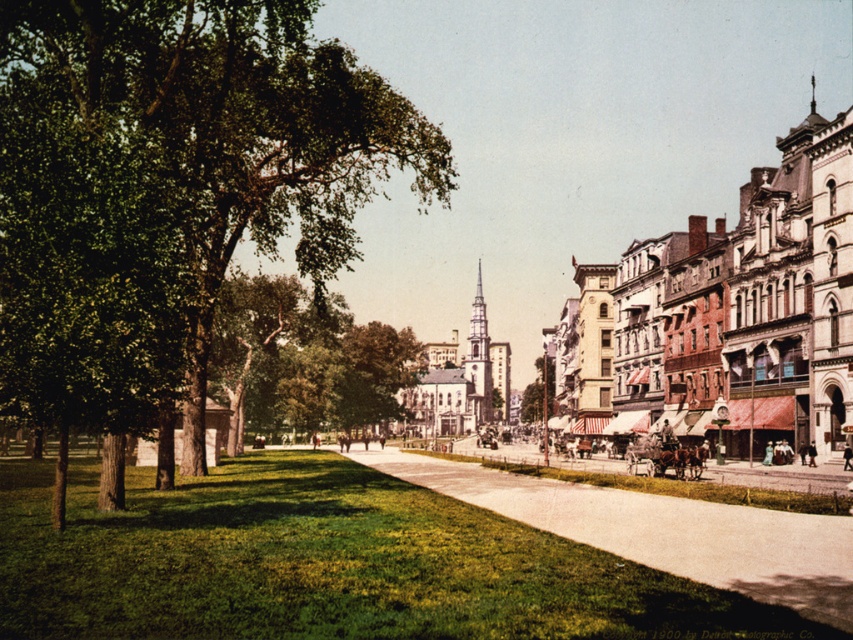
Question: Which of the following is the closest to the observer?

Choices:
 (A) smooth concrete sidewalk at center
 (B) green leafy tree at left

Answer: (A)

Question: Is green leafy tree at left smaller than smooth concrete sidewalk at center?

Choices:
 (A) no
 (B) yes

Answer: (A)

Question: Which point is farther to the camera?

Choices:
 (A) (618, 488)
 (B) (149, 148)

Answer: (A)

Question: Is green leafy tree at left positioned at the back of smooth concrete sidewalk at center?

Choices:
 (A) yes
 (B) no

Answer: (A)

Question: Which point appears closest to the camera in this image?

Choices:
 (A) (709, 508)
 (B) (253, 209)

Answer: (A)

Question: Can you confirm if green leafy tree at left is wider than smooth concrete sidewalk at center?

Choices:
 (A) yes
 (B) no

Answer: (A)